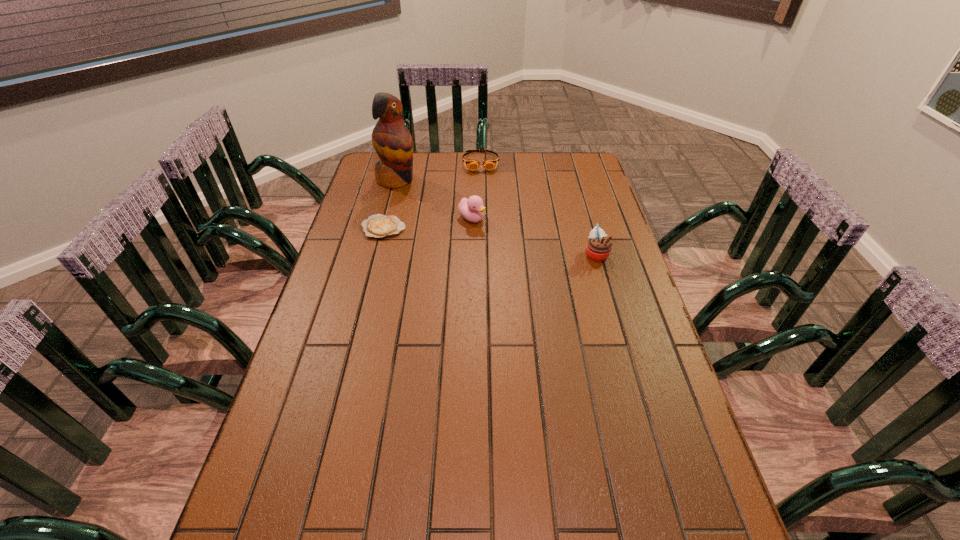
Locate an element on the screen. Image resolution: width=960 pixels, height=540 pixels. vacant region located 0.080m on the face of the parrot is located at coordinates [424, 195].

Locate an element on the screen. The height and width of the screenshot is (540, 960). free spot located 0.250m on the face of the parrot is located at coordinates (457, 213).

Image resolution: width=960 pixels, height=540 pixels. Identify the location of free spot located 0.220m on the face of the parrot. (451, 210).

Where is `vacant region located with the lenses facing forward on the fourth tallest object`? The image size is (960, 540). vacant region located with the lenses facing forward on the fourth tallest object is located at coordinates (487, 225).

Locate an element on the screen. The height and width of the screenshot is (540, 960). vacant space located 0.170m with the lenses facing forward on the fourth tallest object is located at coordinates (484, 197).

Image resolution: width=960 pixels, height=540 pixels. Identify the location of blank space located with the lenses facing forward on the fourth tallest object. (483, 186).

Identify the location of parrot located in the far edge section of the desktop. This screenshot has width=960, height=540. (392, 141).

The height and width of the screenshot is (540, 960). In order to click on goggles at the far edge in this screenshot , I will do `click(489, 164)`.

This screenshot has width=960, height=540. I want to click on quiche located at the left edge, so click(378, 226).

This screenshot has height=540, width=960. I want to click on parrot at the left edge, so click(392, 141).